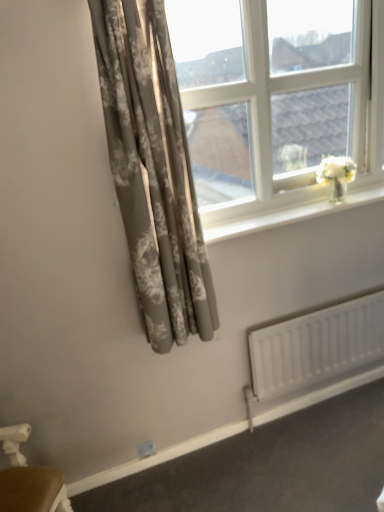
Question: From a real-world perspective, is matte gray floral curtain at left positioned above or below white matte radiator at lower right?

Choices:
 (A) above
 (B) below

Answer: (A)

Question: Is matte gray floral curtain at left taller or shorter than white matte radiator at lower right?

Choices:
 (A) short
 (B) tall

Answer: (B)

Question: Considering the real-world distances, which object is farthest from the clear glass window at upper right?

Choices:
 (A) matte gray floral curtain at left
 (B) white glossy window sill at upper center
 (C) white matte radiator at lower right

Answer: (C)

Question: Which is nearer to the white matte radiator at lower right?

Choices:
 (A) clear glass window at upper right
 (B) white glossy window sill at upper center
 (C) matte gray floral curtain at left

Answer: (B)